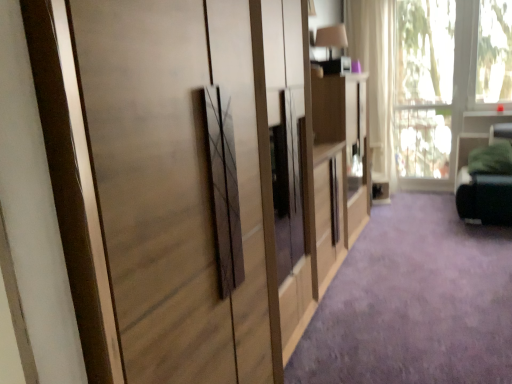
Question: Is white sheer curtain at upper right thinner than transparent glass window at upper right?

Choices:
 (A) yes
 (B) no

Answer: (B)

Question: Does white sheer curtain at upper right lie behind transparent glass window at upper right?

Choices:
 (A) no
 (B) yes

Answer: (B)

Question: Is white sheer curtain at upper right outside transparent glass window at upper right?

Choices:
 (A) no
 (B) yes

Answer: (B)

Question: From a real-world perspective, is white sheer curtain at upper right physically below transparent glass window at upper right?

Choices:
 (A) no
 (B) yes

Answer: (A)

Question: Is white sheer curtain at upper right not close to transparent glass window at upper right?

Choices:
 (A) yes
 (B) no

Answer: (B)

Question: Is point (151, 183) closer or farther from the camera than point (384, 61)?

Choices:
 (A) farther
 (B) closer

Answer: (B)

Question: From the image's perspective, is matte wood cupboard at center positioned above or below white sheer curtain at upper right?

Choices:
 (A) above
 (B) below

Answer: (B)

Question: Is matte wood cupboard at center wider or thinner than white sheer curtain at upper right?

Choices:
 (A) thin
 (B) wide

Answer: (B)

Question: Considering the positions of matte wood cupboard at center and white sheer curtain at upper right in the image, is matte wood cupboard at center bigger or smaller than white sheer curtain at upper right?

Choices:
 (A) small
 (B) big

Answer: (B)

Question: In terms of height, does transparent glass window at upper right look taller or shorter compared to white sheer curtain at upper right?

Choices:
 (A) tall
 (B) short

Answer: (B)

Question: Looking at the image, does transparent glass window at upper right seem bigger or smaller compared to white sheer curtain at upper right?

Choices:
 (A) small
 (B) big

Answer: (A)

Question: Is transparent glass window at upper right wider or thinner than white sheer curtain at upper right?

Choices:
 (A) thin
 (B) wide

Answer: (A)

Question: From the image's perspective, relative to white sheer curtain at upper right, is transparent glass window at upper right above or below?

Choices:
 (A) above
 (B) below

Answer: (B)

Question: Would you say transparent glass window at upper right is inside or outside purple carpet at center?

Choices:
 (A) inside
 (B) outside

Answer: (B)

Question: Is transparent glass window at upper right taller or shorter than purple carpet at center?

Choices:
 (A) tall
 (B) short

Answer: (A)